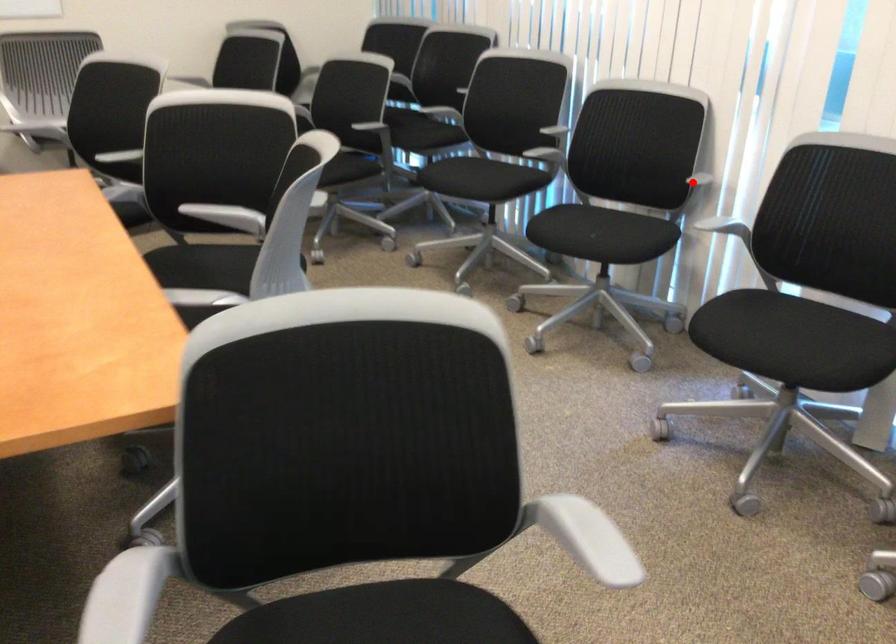
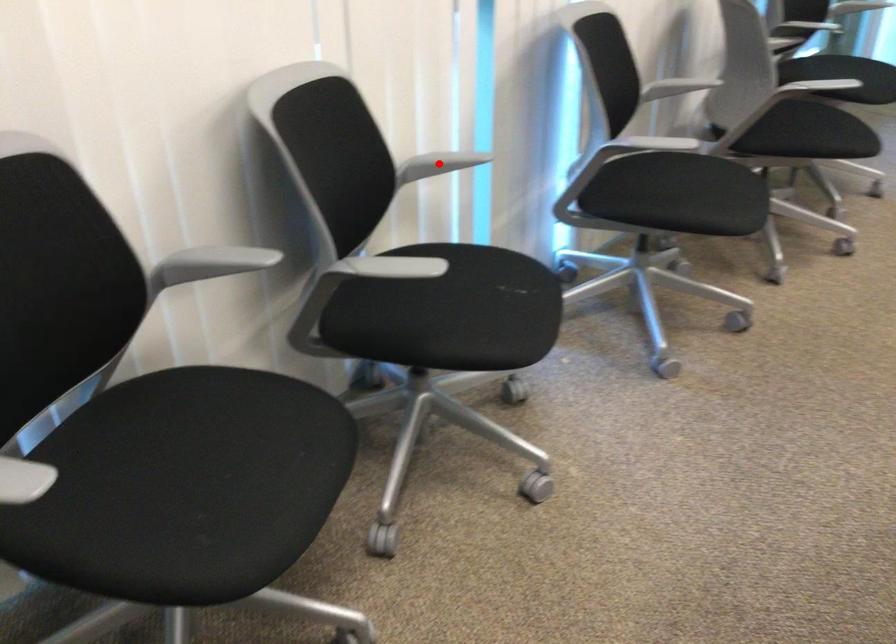
I am providing you with two images of the same scene from different viewpoints. A red point is marked on the first image and another point is marked on the second image. Are the points marked in image1 and image2 representing the same 3D position?

Yes